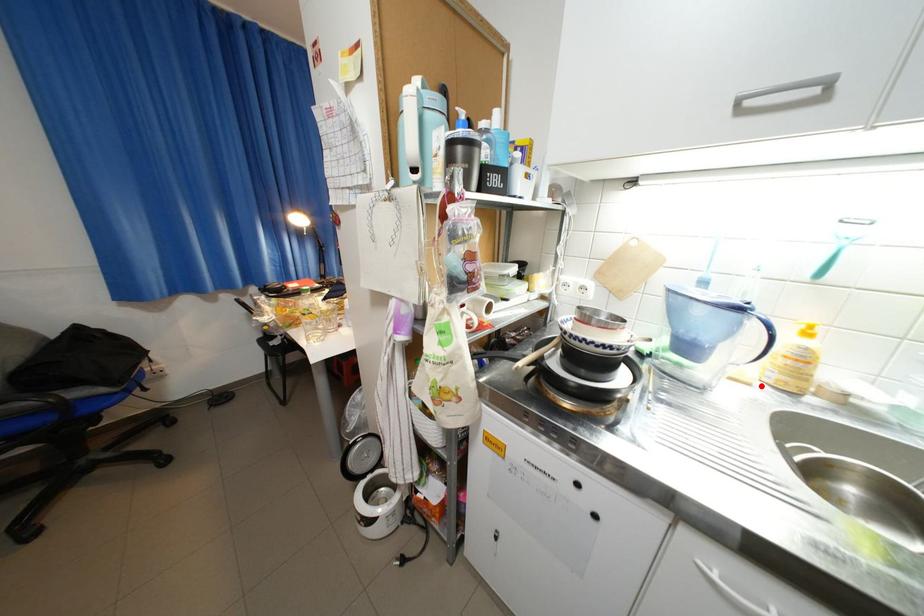
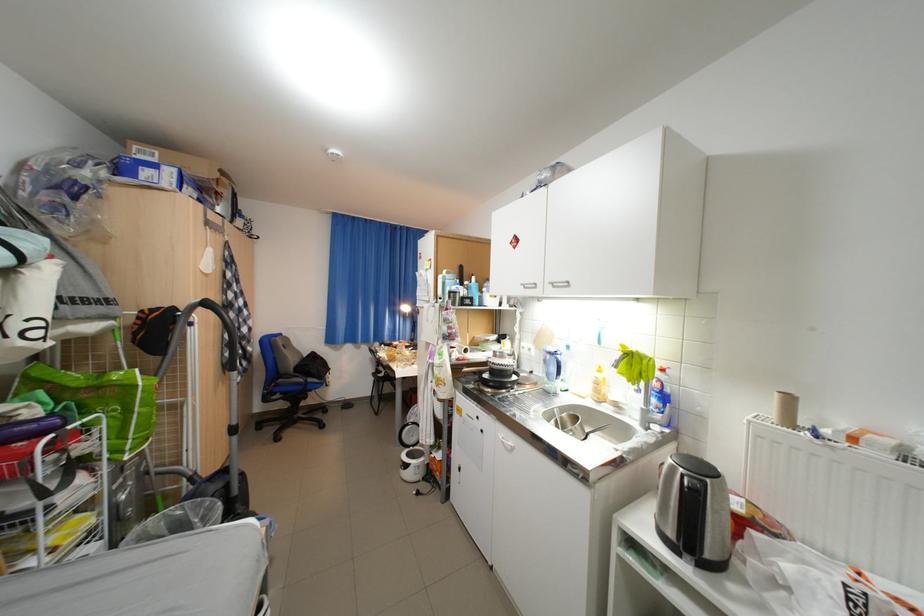
Where in the second image is the point corresponding to the highlighted location from the first image?

(594, 399)